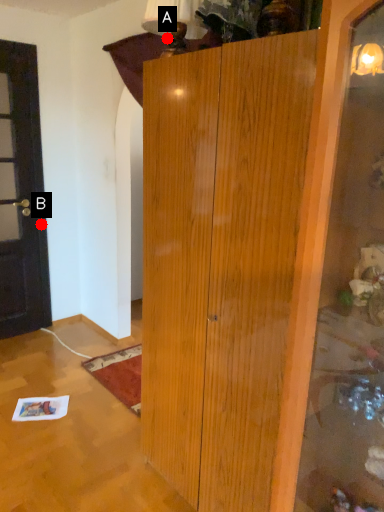
Question: Two points are circled on the image, labeled by A and B beside each circle. Among these points, which one is farthest from the camera?

Choices:
 (A) A is further
 (B) B is further

Answer: (B)